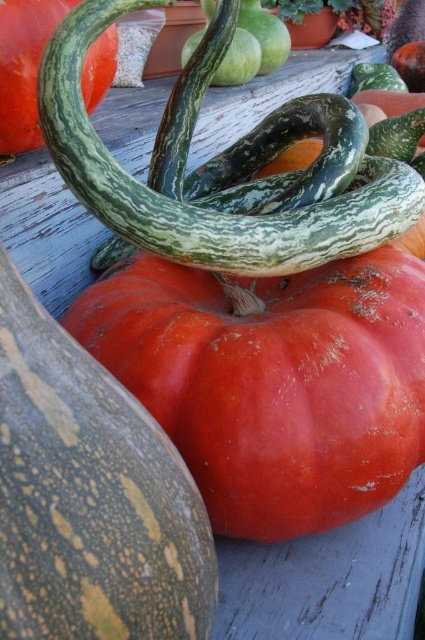
Question: In this image, where is smooth orange pumpkin at center located relative to green striped gourd at center?

Choices:
 (A) below
 (B) above

Answer: (A)

Question: Is smooth orange pumpkin at center positioned in front of green striped gourd at center?

Choices:
 (A) yes
 (B) no

Answer: (A)

Question: Which of the following is the farthest from the observer?

Choices:
 (A) (5, 147)
 (B) (39, 328)

Answer: (A)

Question: Does smooth orange pumpkin at center lie in front of green striped gourd at center?

Choices:
 (A) no
 (B) yes

Answer: (B)